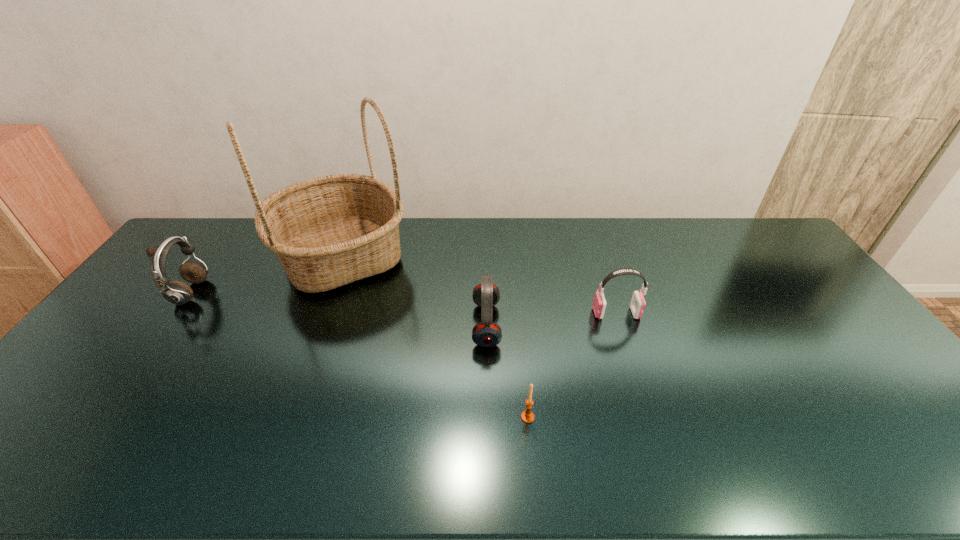
The width and height of the screenshot is (960, 540). I want to click on the closest object relative to the third object from right to left, so click(x=527, y=416).

Identify the location of the fourth closest object relative to the second earphone from left to right. (176, 292).

The width and height of the screenshot is (960, 540). I want to click on the closest earphone to the fourth object from left to right, so click(486, 295).

Locate an element on the screen. This screenshot has height=540, width=960. earphone that stands as the closest to the third object from right to left is located at coordinates coord(637,305).

I want to click on free space that satisfies the following two spatial constraints: 1. on the front side of the tallest object; 2. on the ear pads of the tallest earphone, so click(327, 293).

Where is `free space that satisfies the following two spatial constraints: 1. on the front side of the second object from left to right; 2. on the right side of the candle_holder`? The image size is (960, 540). free space that satisfies the following two spatial constraints: 1. on the front side of the second object from left to right; 2. on the right side of the candle_holder is located at coordinates (280, 417).

At what (x,y) coordinates should I click in order to perform the action: click on vacant area that satisfies the following two spatial constraints: 1. on the ear pads of the leftmost object; 2. on the left side of the nearest object. Please return your answer as a coordinate pair (x, y). Looking at the image, I should click on (101, 417).

This screenshot has width=960, height=540. In order to click on blank area in the image that satisfies the following two spatial constraints: 1. on the front side of the tallest object; 2. on the ear pads of the second tallest object in this screenshot , I will do `click(327, 293)`.